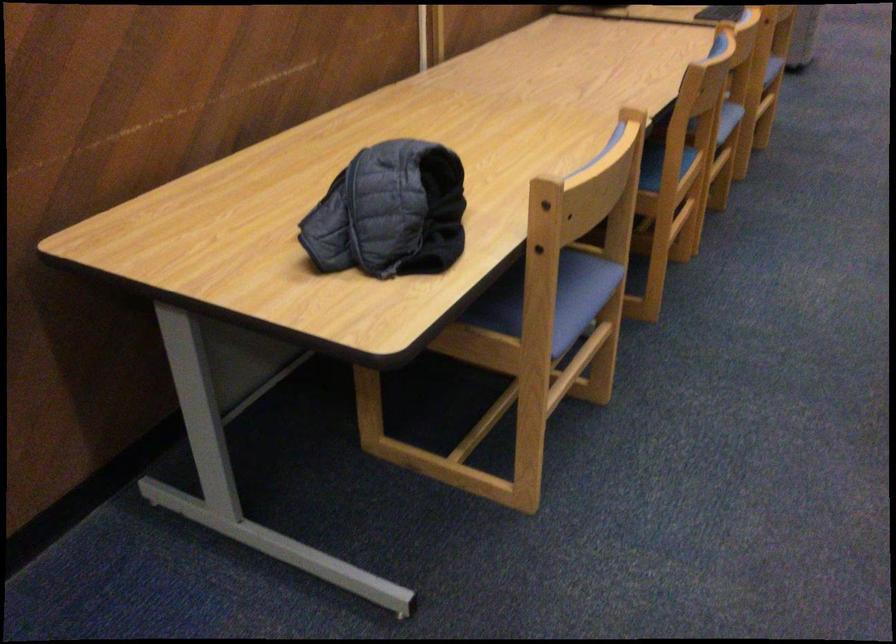
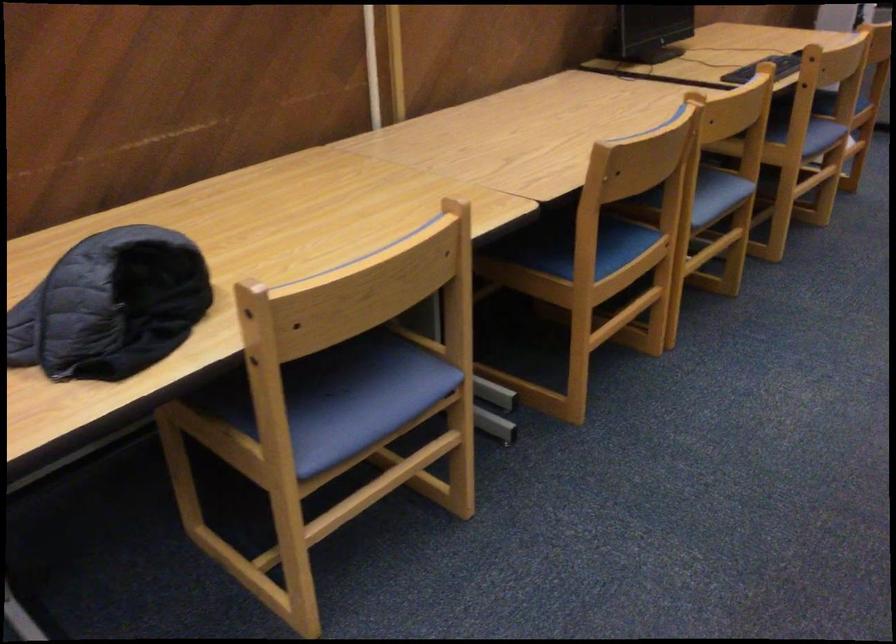
Question: The images are taken continuously from a first-person perspective. In which direction are you moving?

Choices:
 (A) Left
 (B) Right
 (C) Forward
 (D) Backward

Answer: (B)